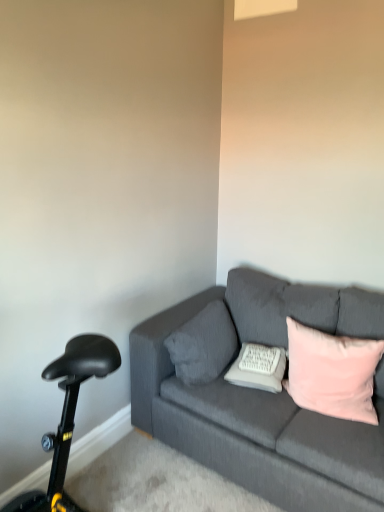
What do you see at coordinates (332, 373) in the screenshot? I see `pink velvet pillow at right, marked as the first pillow in a right-to-left arrangement` at bounding box center [332, 373].

Describe the element at coordinates (258, 367) in the screenshot. I see `white textured pillow at center, the second pillow positioned from the left` at that location.

Where is `black plastic bicycle at lower left`? The image size is (384, 512). black plastic bicycle at lower left is located at coordinates (67, 417).

What do you see at coordinates (203, 345) in the screenshot?
I see `textured gray pillow at center, the first pillow when ordered from left to right` at bounding box center [203, 345].

Identify the location of pink velvet pillow at right, the third pillow in the left-to-right sequence. (332, 373).

Is textured gray pillow at center, the first pillow when ordered from left to right, to the left or to the right of white textured pillow at center, the second pillow positioned from the left, in the image?

Clearly, textured gray pillow at center, the first pillow when ordered from left to right, is on the left of white textured pillow at center, the second pillow positioned from the left, in the image.

Based on the photo, considering the positions of objects textured gray pillow at center, which is counted as the 3th pillow, starting from the right, and white textured pillow at center, the second pillow positioned from the left, in the image provided, who is behind, textured gray pillow at center, which is counted as the 3th pillow, starting from the right, or white textured pillow at center, the second pillow positioned from the left,?

white textured pillow at center, the second pillow positioned from the left, is more distant.

Which is farther, (209, 380) or (244, 368)?

Point (209, 380)

Considering the relative sizes of textured gray pillow at center, the first pillow when ordered from left to right, and white textured pillow at center, the second pillow positioned from the left, in the image provided, is textured gray pillow at center, the first pillow when ordered from left to right, wider than white textured pillow at center, the second pillow positioned from the left,?

Incorrect, the width of textured gray pillow at center, the first pillow when ordered from left to right, does not surpass that of white textured pillow at center, the second pillow positioned from the left.

Is textured gray pillow at center, which is counted as the 3th pillow, starting from the right, further to camera compared to black plastic bicycle at lower left?

Yes, it is.

Is textured gray pillow at center, which is counted as the 3th pillow, starting from the right, wider than black plastic bicycle at lower left?

Yes, textured gray pillow at center, which is counted as the 3th pillow, starting from the right, is wider than black plastic bicycle at lower left.

From the image's perspective, relative to black plastic bicycle at lower left, is textured gray pillow at center, the first pillow when ordered from left to right, above or below?

Clearly, from the image's perspective, textured gray pillow at center, the first pillow when ordered from left to right, is above black plastic bicycle at lower left.

Considering the sizes of objects textured gray pillow at center, the first pillow when ordered from left to right, and pink velvet pillow at right, marked as the first pillow in a right-to-left arrangement, in the image provided, who is taller, textured gray pillow at center, the first pillow when ordered from left to right, or pink velvet pillow at right, marked as the first pillow in a right-to-left arrangement,?

With more height is textured gray pillow at center, the first pillow when ordered from left to right.

Relative to pink velvet pillow at right, the third pillow in the left-to-right sequence, is textured gray pillow at center, the first pillow when ordered from left to right, in front or behind?

textured gray pillow at center, the first pillow when ordered from left to right, is behind pink velvet pillow at right, the third pillow in the left-to-right sequence.

How far apart are textured gray pillow at center, the first pillow when ordered from left to right, and pink velvet pillow at right, marked as the first pillow in a right-to-left arrangement?

textured gray pillow at center, the first pillow when ordered from left to right, and pink velvet pillow at right, marked as the first pillow in a right-to-left arrangement, are 18.95 inches apart from each other.

Looking at their sizes, would you say textured gray pillow at center, the first pillow when ordered from left to right, is wider or thinner than pink velvet pillow at right, the third pillow in the left-to-right sequence?

In the image, textured gray pillow at center, the first pillow when ordered from left to right, appears to be more narrow than pink velvet pillow at right, the third pillow in the left-to-right sequence.

Does dark gray fabric couch at center have a lesser width compared to black plastic bicycle at lower left?

Incorrect, the width of dark gray fabric couch at center is not less than that of black plastic bicycle at lower left.

From the image's perspective, is dark gray fabric couch at center above black plastic bicycle at lower left?

Yes, from the image's perspective, dark gray fabric couch at center is over black plastic bicycle at lower left.

In the scene shown: Is dark gray fabric couch at center outside of black plastic bicycle at lower left?

Absolutely, dark gray fabric couch at center is external to black plastic bicycle at lower left.

Does dark gray fabric couch at center appear on the right side of black plastic bicycle at lower left?

Yes, dark gray fabric couch at center is to the right of black plastic bicycle at lower left.

Which of these two, pink velvet pillow at right, marked as the first pillow in a right-to-left arrangement, or white textured pillow at center, the second pillow positioned from the left, is smaller?

white textured pillow at center, the second pillow positioned from the left, is smaller.

From the picture: How much distance is there between pink velvet pillow at right, the third pillow in the left-to-right sequence, and white textured pillow at center, the second pillow positioned from the left?

pink velvet pillow at right, the third pillow in the left-to-right sequence, and white textured pillow at center, the second pillow positioned from the left, are 9.24 inches apart from each other.

Is pink velvet pillow at right, the third pillow in the left-to-right sequence, thinner than white textured pillow at center, the second pillow positioned from the left?

No, pink velvet pillow at right, the third pillow in the left-to-right sequence, is not thinner than white textured pillow at center, the second pillow positioned from the left.

Is pink velvet pillow at right, marked as the first pillow in a right-to-left arrangement, not close to white textured pillow at center, the second pillow when ordered from right to left?

No.

Which point is more distant from viewer, (x=262, y=346) or (x=76, y=337)?

The point (x=262, y=346) is more distant.

Is white textured pillow at center, the second pillow positioned from the left, inside or outside of black plastic bicycle at lower left?

white textured pillow at center, the second pillow positioned from the left, is spatially situated outside black plastic bicycle at lower left.

Between white textured pillow at center, the second pillow positioned from the left, and black plastic bicycle at lower left, which one has smaller width?

black plastic bicycle at lower left is thinner.

From the picture: Which of these two, white textured pillow at center, the second pillow when ordered from right to left, or black plastic bicycle at lower left, is smaller?

black plastic bicycle at lower left is smaller.

Considering the sizes of objects pink velvet pillow at right, marked as the first pillow in a right-to-left arrangement, and black plastic bicycle at lower left in the image provided, who is smaller, pink velvet pillow at right, marked as the first pillow in a right-to-left arrangement, or black plastic bicycle at lower left?

Smaller between the two is black plastic bicycle at lower left.

The image size is (384, 512). Find the location of `the 3rd pillow to the right when counting from the black plastic bicycle at lower left`. the 3rd pillow to the right when counting from the black plastic bicycle at lower left is located at coordinates (332, 373).

From the image's perspective, relative to black plastic bicycle at lower left, is pink velvet pillow at right, the third pillow in the left-to-right sequence, above or below?

pink velvet pillow at right, the third pillow in the left-to-right sequence, is above black plastic bicycle at lower left.

Consider the image. Is pink velvet pillow at right, the third pillow in the left-to-right sequence, shorter than black plastic bicycle at lower left?

In fact, pink velvet pillow at right, the third pillow in the left-to-right sequence, may be taller than black plastic bicycle at lower left.

I want to click on the 2nd pillow located beneath the textured gray pillow at center, the first pillow when ordered from left to right (from a real-world perspective), so click(x=258, y=367).

Find the location of a particular element. bicycle located in front of the textured gray pillow at center, the first pillow when ordered from left to right is located at coordinates (67, 417).

Looking at the image, which one is located closer to black plastic bicycle at lower left, dark gray fabric couch at center or white textured pillow at center, the second pillow when ordered from right to left?

dark gray fabric couch at center is closer to black plastic bicycle at lower left.

Based on their spatial positions, is textured gray pillow at center, which is counted as the 3th pillow, starting from the right, or black plastic bicycle at lower left closer to pink velvet pillow at right, the third pillow in the left-to-right sequence?

textured gray pillow at center, which is counted as the 3th pillow, starting from the right, is positioned closer to the anchor pink velvet pillow at right, the third pillow in the left-to-right sequence.

When comparing their distances from textured gray pillow at center, which is counted as the 3th pillow, starting from the right, does white textured pillow at center, the second pillow positioned from the left, or black plastic bicycle at lower left seem further?

Among the two, black plastic bicycle at lower left is located further to textured gray pillow at center, which is counted as the 3th pillow, starting from the right.

Considering their positions, is white textured pillow at center, the second pillow positioned from the left, positioned closer to black plastic bicycle at lower left than pink velvet pillow at right, the third pillow in the left-to-right sequence?

The object closer to black plastic bicycle at lower left is white textured pillow at center, the second pillow positioned from the left.

Based on their spatial positions, is dark gray fabric couch at center or textured gray pillow at center, the first pillow when ordered from left to right, closer to pink velvet pillow at right, the third pillow in the left-to-right sequence?

The object closer to pink velvet pillow at right, the third pillow in the left-to-right sequence, is dark gray fabric couch at center.

In the scene shown: Which object lies nearer to the anchor point textured gray pillow at center, which is counted as the 3th pillow, starting from the right, black plastic bicycle at lower left or dark gray fabric couch at center?

dark gray fabric couch at center is closer to textured gray pillow at center, which is counted as the 3th pillow, starting from the right.

Estimate the real-world distances between objects in this image. Which object is closer to black plastic bicycle at lower left, pink velvet pillow at right, the third pillow in the left-to-right sequence, or textured gray pillow at center, the first pillow when ordered from left to right?

textured gray pillow at center, the first pillow when ordered from left to right.

When comparing their distances from dark gray fabric couch at center, does white textured pillow at center, the second pillow positioned from the left, or pink velvet pillow at right, the third pillow in the left-to-right sequence, seem further?

Based on the image, white textured pillow at center, the second pillow positioned from the left, appears to be further to dark gray fabric couch at center.

Where is `studio couch located between black plastic bicycle at lower left and pink velvet pillow at right, the third pillow in the left-to-right sequence, in the left-right direction`? studio couch located between black plastic bicycle at lower left and pink velvet pillow at right, the third pillow in the left-to-right sequence, in the left-right direction is located at coordinates (264, 397).

This screenshot has width=384, height=512. Find the location of `pillow between dark gray fabric couch at center and textured gray pillow at center, which is counted as the 3th pillow, starting from the right, along the z-axis`. pillow between dark gray fabric couch at center and textured gray pillow at center, which is counted as the 3th pillow, starting from the right, along the z-axis is located at coordinates (332, 373).

At what (x,y) coordinates should I click in order to perform the action: click on pillow located between textured gray pillow at center, which is counted as the 3th pillow, starting from the right, and pink velvet pillow at right, marked as the first pillow in a right-to-left arrangement, in the left-right direction. Please return your answer as a coordinate pair (x, y). The image size is (384, 512). Looking at the image, I should click on (258, 367).

Locate an element on the screen. Image resolution: width=384 pixels, height=512 pixels. pillow located between black plastic bicycle at lower left and white textured pillow at center, the second pillow positioned from the left, in the left-right direction is located at coordinates (203, 345).